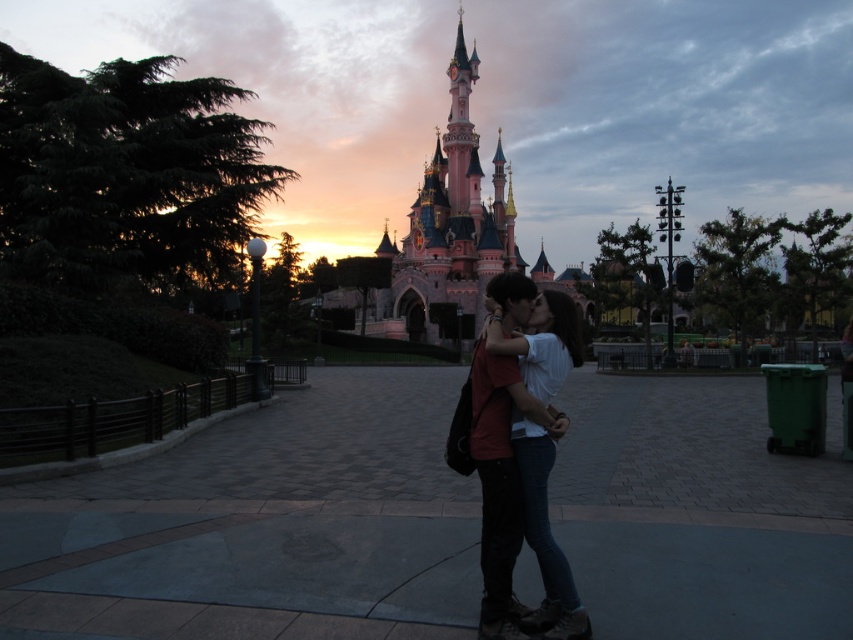
Is matte black couple at center shorter than pink painted stone castle at center?

Yes, matte black couple at center is shorter than pink painted stone castle at center.

Does point (563, 356) lie in front of point (445, 168)?

Yes, point (563, 356) is closer to viewer.

Identify the location of matte black couple at center. The image size is (853, 640). (521, 452).